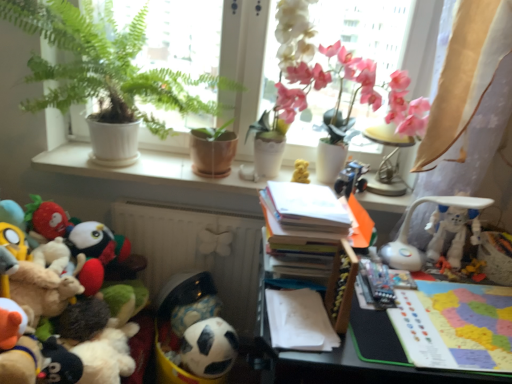
The width and height of the screenshot is (512, 384). I want to click on smooth plastic table at lower right, so click(362, 369).

This screenshot has height=384, width=512. What do you see at coordinates (362, 369) in the screenshot?
I see `smooth plastic table at lower right` at bounding box center [362, 369].

The image size is (512, 384). Identify the location of yellow plush bear at center, placed as the third toy when sorted from left to right. tap(301, 172).

Locate an element on the screen. This screenshot has width=512, height=384. matte brown pot at center is located at coordinates (212, 153).

What is the approximate height of multicolored paper map at right, which appears as the 1th book when viewed from the right?

multicolored paper map at right, which appears as the 1th book when viewed from the right, is 1.09 inches in height.

Find the location of a particular element. This screenshot has width=512, height=384. white paper book at center, the 2th book positioned from the right is located at coordinates (303, 218).

Could you tell me if metallic blue robot at center, positioned as the 3th toy in right-to-left order, is facing white plastic robot at right, which appears as the first toy when viewed from the right?

No, metallic blue robot at center, positioned as the 3th toy in right-to-left order, is not turned towards white plastic robot at right, which appears as the first toy when viewed from the right.

From the image's perspective, is metallic blue robot at center, the 4th toy in the left-to-right sequence, positioned above or below white plastic robot at right, which is the sixth toy from left to right?

Based on their image positions, metallic blue robot at center, the 4th toy in the left-to-right sequence, is located above white plastic robot at right, which is the sixth toy from left to right.

Would you say metallic blue robot at center, positioned as the 3th toy in right-to-left order, is to the left or to the right of white plastic robot at right, which appears as the first toy when viewed from the right, in the picture?

metallic blue robot at center, positioned as the 3th toy in right-to-left order, is to the left of white plastic robot at right, which appears as the first toy when viewed from the right.

Considering the points (354, 186) and (438, 247), which point is in front, point (354, 186) or point (438, 247)?

The point (438, 247) is closer.

Looking at this image, can you confirm if white ceramic vase at upper center, positioned as the 1th houseplant in right-to-left order, is thinner than white plastic robot at right, which appears as the first toy when viewed from the right?

No, white ceramic vase at upper center, positioned as the 1th houseplant in right-to-left order, is not thinner than white plastic robot at right, which appears as the first toy when viewed from the right.

From their relative heights in the image, would you say white ceramic vase at upper center, positioned as the 1th houseplant in right-to-left order, is taller or shorter than white plastic robot at right, which appears as the first toy when viewed from the right?

Considering their sizes, white ceramic vase at upper center, positioned as the 1th houseplant in right-to-left order, has more height than white plastic robot at right, which appears as the first toy when viewed from the right.

Relative to white plastic robot at right, which appears as the first toy when viewed from the right, is white ceramic vase at upper center, positioned as the 1th houseplant in right-to-left order, in front or behind?

Clearly, white ceramic vase at upper center, positioned as the 1th houseplant in right-to-left order, is in front of white plastic robot at right, which appears as the first toy when viewed from the right.

Could you tell me if white ceramic vase at upper center, positioned as the 1th houseplant in right-to-left order, is facing white plastic robot at right, which appears as the first toy when viewed from the right?

No.

Is white matte pot at upper left, the 1th houseplant in the left-to-right sequence, inside the boundaries of white matte plant at upper center, or outside?

white matte pot at upper left, the 1th houseplant in the left-to-right sequence, is enclosed within white matte plant at upper center.

Which of these two, white matte pot at upper left, the 1th houseplant in the left-to-right sequence, or white matte plant at upper center, stands shorter?

white matte pot at upper left, the 1th houseplant in the left-to-right sequence, is shorter.

Looking at this image, is the depth of white matte pot at upper left, the 1th houseplant in the left-to-right sequence, less than that of white matte plant at upper center?

Yes, it is.

Could you tell me if white matte pot at upper left, the 1th houseplant in the left-to-right sequence, is facing white matte plant at upper center?

No, white matte pot at upper left, the 1th houseplant in the left-to-right sequence, is not aimed at white matte plant at upper center.

Are yellow plush bear at center, placed as the third toy when sorted from left to right, and white matte pot at upper left, the 1th houseplant in the left-to-right sequence, beside each other?

No, yellow plush bear at center, placed as the third toy when sorted from left to right, is not in contact with white matte pot at upper left, the 1th houseplant in the left-to-right sequence.

From a real-world perspective, which object rests below the other?

yellow plush bear at center, placed as the third toy when sorted from left to right.

Is yellow plush bear at center, acting as the fourth toy starting from the right, to the left or to the right of white matte pot at upper left, the 1th houseplant in the left-to-right sequence, in the image?

In the image, yellow plush bear at center, acting as the fourth toy starting from the right, appears on the right side of white matte pot at upper left, the 1th houseplant in the left-to-right sequence.

What are the coordinates of `table that is under the yellow plush bear at center, acting as the fourth toy starting from the right (from a real-world perspective)` in the screenshot? It's located at (362, 369).

From a real-world perspective, between yellow plush bear at center, placed as the third toy when sorted from left to right, and smooth plastic table at lower right, who is vertically higher?

From a 3D spatial view, yellow plush bear at center, placed as the third toy when sorted from left to right, is above.

Considering the sizes of objects yellow plush bear at center, acting as the fourth toy starting from the right, and smooth plastic table at lower right in the image provided, who is shorter, yellow plush bear at center, acting as the fourth toy starting from the right, or smooth plastic table at lower right?

With less height is yellow plush bear at center, acting as the fourth toy starting from the right.

Based on the photo, considering the sizes of objects yellow plush bear at center, acting as the fourth toy starting from the right, and smooth plastic table at lower right in the image provided, who is wider, yellow plush bear at center, acting as the fourth toy starting from the right, or smooth plastic table at lower right?

With larger width is smooth plastic table at lower right.

How distant is white matte plant at upper center from white ceramic pots at upper center?

white matte plant at upper center is 15.22 inches from white ceramic pots at upper center.

How many degrees apart are the facing directions of white matte plant at upper center and white ceramic pots at upper center?

The angle between the facing direction of white matte plant at upper center and the facing direction of white ceramic pots at upper center is 0.0011 degrees.

From the image's perspective, is white matte plant at upper center above white ceramic pots at upper center?

Yes, from the image's perspective, white matte plant at upper center is on top of white ceramic pots at upper center.

Considering the points (247, 147) and (72, 158), which point is behind, point (247, 147) or point (72, 158)?

The point (247, 147) is farther.

Could you measure the distance between fluffy plush toys at left, which ranks as the first toy in left-to-right order, and beige sheer curtain at upper right?

A distance of 1.12 meters exists between fluffy plush toys at left, which ranks as the first toy in left-to-right order, and beige sheer curtain at upper right.

In terms of height, does fluffy plush toys at left, which ranks as the first toy in left-to-right order, look taller or shorter compared to beige sheer curtain at upper right?

In the image, fluffy plush toys at left, which ranks as the first toy in left-to-right order, appears to be taller than beige sheer curtain at upper right.

Considering the positions of objects fluffy plush toys at left, which appears as the 6th toy when viewed from the right, and beige sheer curtain at upper right in the image provided, who is more to the left, fluffy plush toys at left, which appears as the 6th toy when viewed from the right, or beige sheer curtain at upper right?

fluffy plush toys at left, which appears as the 6th toy when viewed from the right.

Identify the location of the 2nd toy to the right of the metallic blue robot at center, the 4th toy in the left-to-right sequence, starting your count from the anchor. (451, 232).

Locate an element on the screen. Image resolution: width=512 pixels, height=384 pixels. the 4th toy below when counting from the white ceramic vase at upper center, positioned as the 1th houseplant in right-to-left order (from the image's perspective) is located at coordinates (451, 232).

Based on their spatial positions, is white ceramic vase at upper center, positioned as the 1th houseplant in right-to-left order, or white matte plant at upper center further from yellow plush bear at center, placed as the third toy when sorted from left to right?

white matte plant at upper center is further to yellow plush bear at center, placed as the third toy when sorted from left to right.

When comparing their distances from matte brown pot at center, does white matte pot at upper left, the 1th houseplant in the left-to-right sequence, or white plastic lamp at upper right seem closer?

white matte pot at upper left, the 1th houseplant in the left-to-right sequence.

When comparing their distances from beige sheer curtain at upper right, does white plastic lamp at upper right or white plastic robot at right, the fifth toy when ordered from left to right, seem closer?

white plastic robot at right, the fifth toy when ordered from left to right, lies closer to beige sheer curtain at upper right than the other object.

When comparing their distances from white plastic robot at right, the fifth toy when ordered from left to right, does white matte plant at upper center or beige sheer curtain at upper right seem closer?

Among the two, beige sheer curtain at upper right is located nearer to white plastic robot at right, the fifth toy when ordered from left to right.

Looking at the image, which one is located closer to white plastic robot at right, the 2th toy viewed from the right, yellow plush bear at center, acting as the fourth toy starting from the right, or white plastic lamp at upper right?

white plastic lamp at upper right is closer to white plastic robot at right, the 2th toy viewed from the right.

Considering their positions, is smooth plastic table at lower right positioned further to metallic blue robot at center, positioned as the 3th toy in right-to-left order, than pink silk orchid at upper right?

smooth plastic table at lower right is further to metallic blue robot at center, positioned as the 3th toy in right-to-left order.

In the scene shown: Considering their positions, is white ceramic pots at upper center positioned closer to beige sheer curtain at upper right than smooth plastic table at lower right?

Among the two, white ceramic pots at upper center is located nearer to beige sheer curtain at upper right.

When comparing their distances from beige sheer curtain at upper right, does metallic blue robot at center, positioned as the 3th toy in right-to-left order, or white plastic robot at right, which appears as the first toy when viewed from the right, seem closer?

The object closer to beige sheer curtain at upper right is white plastic robot at right, which appears as the first toy when viewed from the right.

You are a GUI agent. You are given a task and a screenshot of the screen. Output one action in this format:
    pyautogui.click(x=<x>, y=<y>)
    Task: Click on the flower between white matte pot at upper left, marked as the second houseplant in a right-to-left arrangement, and metallic blue robot at center, the 4th toy in the left-to-right sequence, from left to right
    Image resolution: width=512 pixels, height=384 pixels.
    Given the screenshot: What is the action you would take?
    pyautogui.click(x=315, y=65)

Image resolution: width=512 pixels, height=384 pixels. Find the location of `notepad between white matte pot at upper left, marked as the second houseplant in a right-to-left arrangement, and black and white textured soccer ball at center, which is counted as the 5th toy, starting from the right, from top to bottom`. notepad between white matte pot at upper left, marked as the second houseplant in a right-to-left arrangement, and black and white textured soccer ball at center, which is counted as the 5th toy, starting from the right, from top to bottom is located at coordinates (298, 321).

In order to click on book between white ceramic vase at upper center, which is counted as the second houseplant, starting from the left, and white plastic robot at right, the fifth toy when ordered from left to right, from top to bottom in this screenshot , I will do `click(303, 218)`.

This screenshot has height=384, width=512. I want to click on toy situated between fluffy plush toys at left, which appears as the 6th toy when viewed from the right, and white paper book at center, arranged as the 1th book when viewed from the top, from left to right, so click(209, 348).